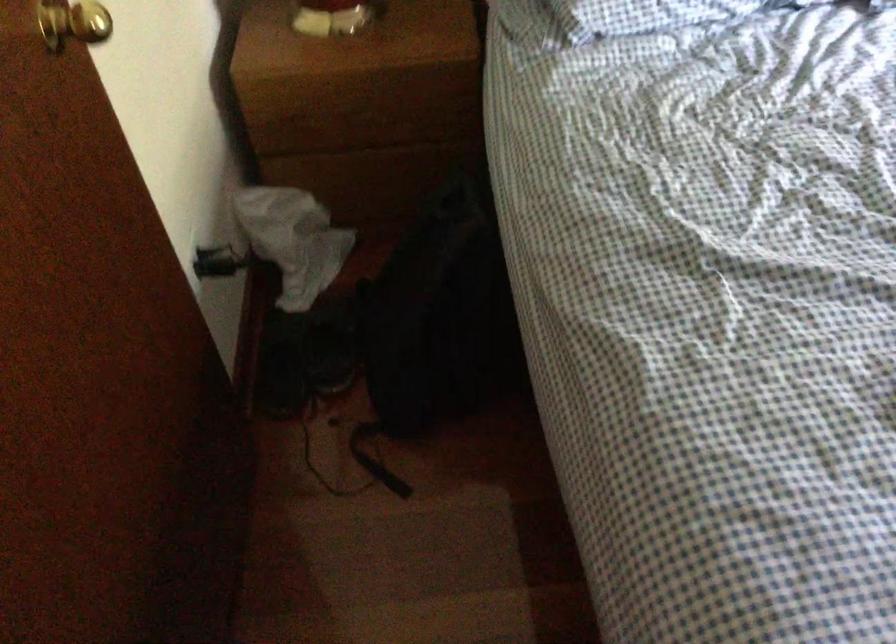
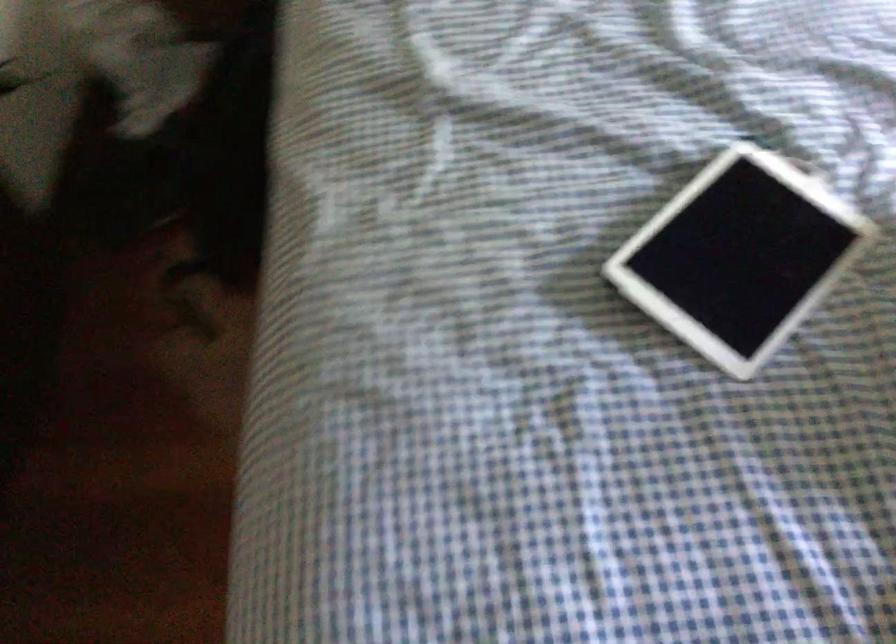
Question: The images are taken continuously from a first-person perspective. In which direction is your viewpoint rotating?

Choices:
 (A) Left
 (B) Right
 (C) Up
 (D) Down

Answer: (D)